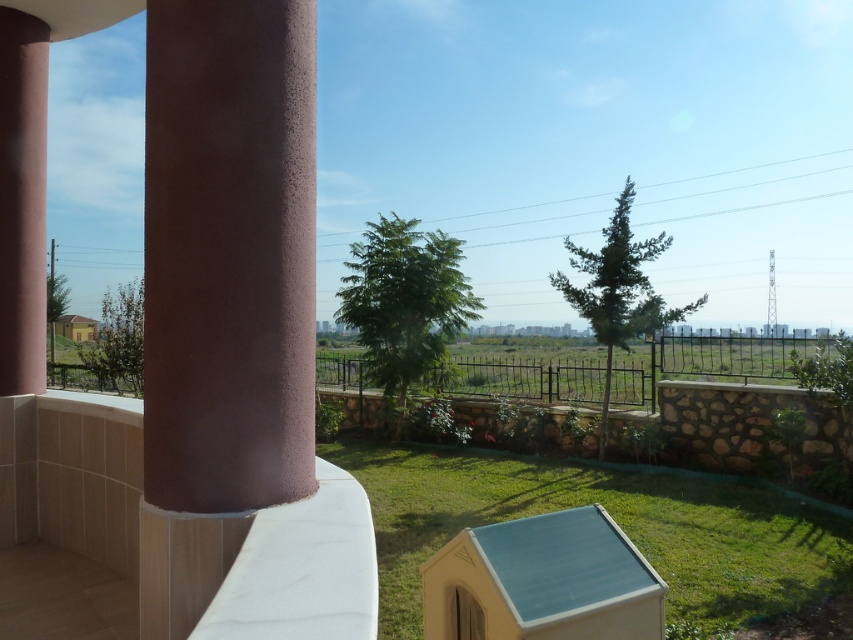
Question: From the image, what is the correct spatial relationship of sandy pink concrete pillar at left in relation to matte pink column at left?

Choices:
 (A) below
 (B) above

Answer: (A)

Question: Is sandy pink concrete pillar at left bigger than matte pink column at left?

Choices:
 (A) no
 (B) yes

Answer: (B)

Question: Can you confirm if sandy pink concrete pillar at left is positioned below matte pink column at left?

Choices:
 (A) yes
 (B) no

Answer: (A)